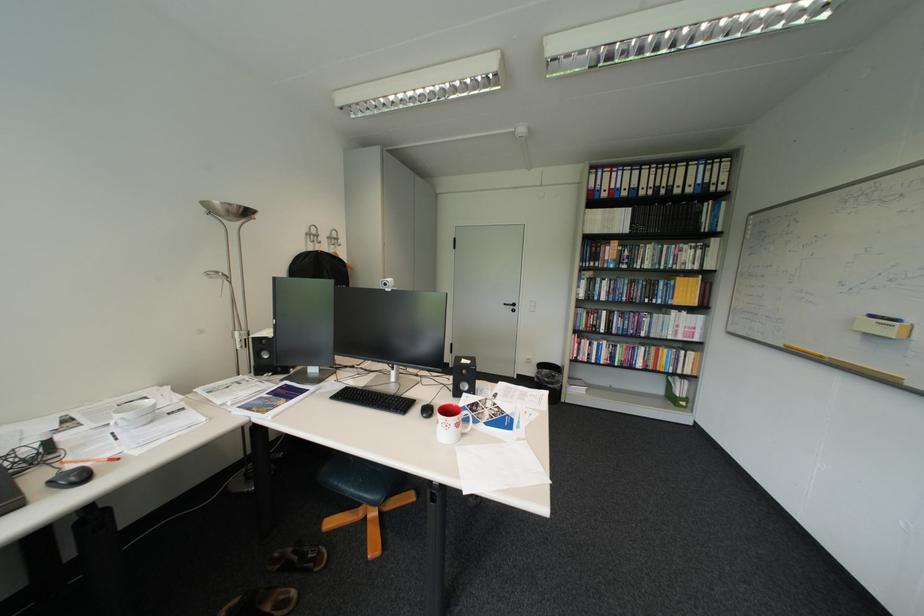
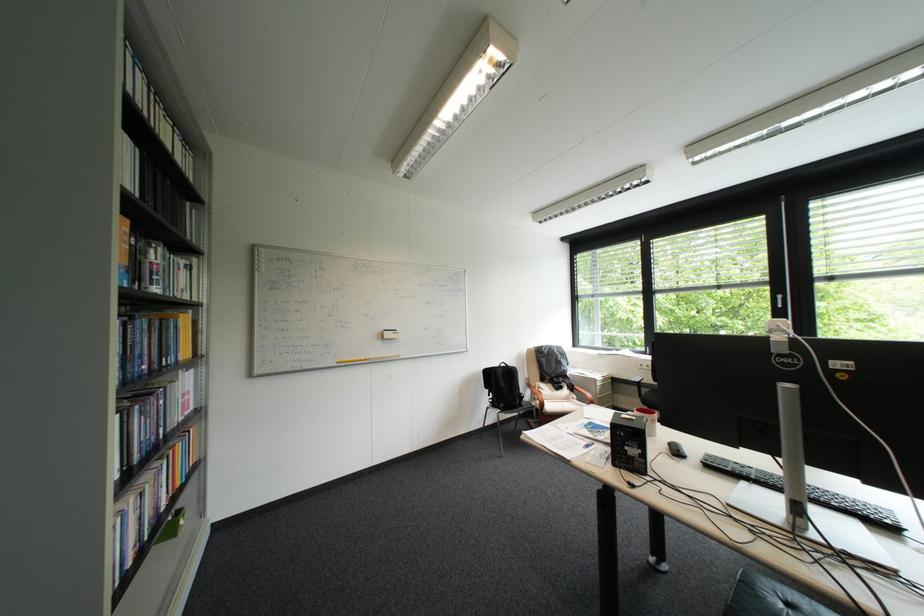
The point at (638, 283) is marked in the first image. Where is the corresponding point in the second image?

(159, 326)